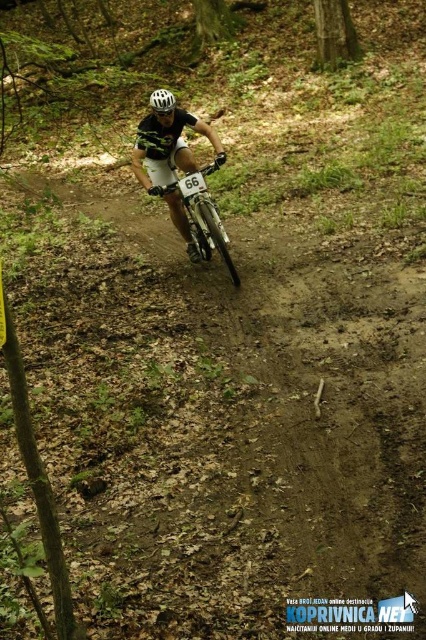
You are a drone operator trying to capture the mountain biker in the forest. You have two points marked on your screen, point A at coordinates point (x=172, y=168) and point B at coordinates point (x=218, y=250). Which point is closer to the camera?

Point point (x=172, y=168) is closer to the camera because it is further to the viewer than point point (x=218, y=250).

You are a photographer positioned behind the rider, wanting to capture a photo of both the shiny metallic bicycle at center and the white matte bicycle helmet at center without any overlap. Given that your camera has a maximum focus range of 4 feet, can you achieve this shot?

The distance between the shiny metallic bicycle at center and the white matte bicycle helmet at center is 4.15 feet. Since the camera can only focus up to 4 feet, the photographer cannot capture both objects clearly in the same photo without overlap.

Consider the image. You are a drone operator trying to capture the mountain biker on the brown dirt track at center and the white matte bicycle helmet at center. From above, which object is positioned lower in the image?

The brown dirt track at center is located below the white matte bicycle helmet at center, so the brown dirt track at center is positioned lower in the image.